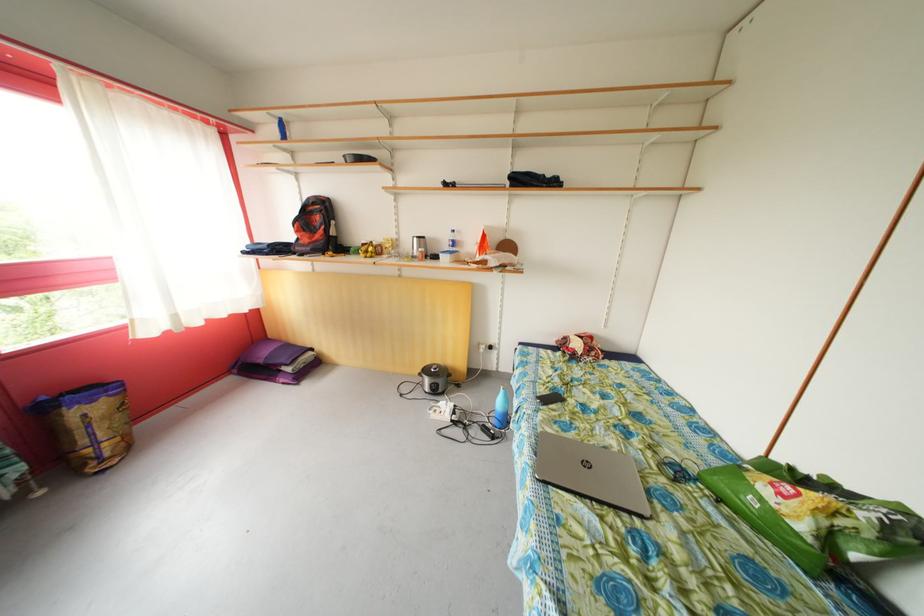
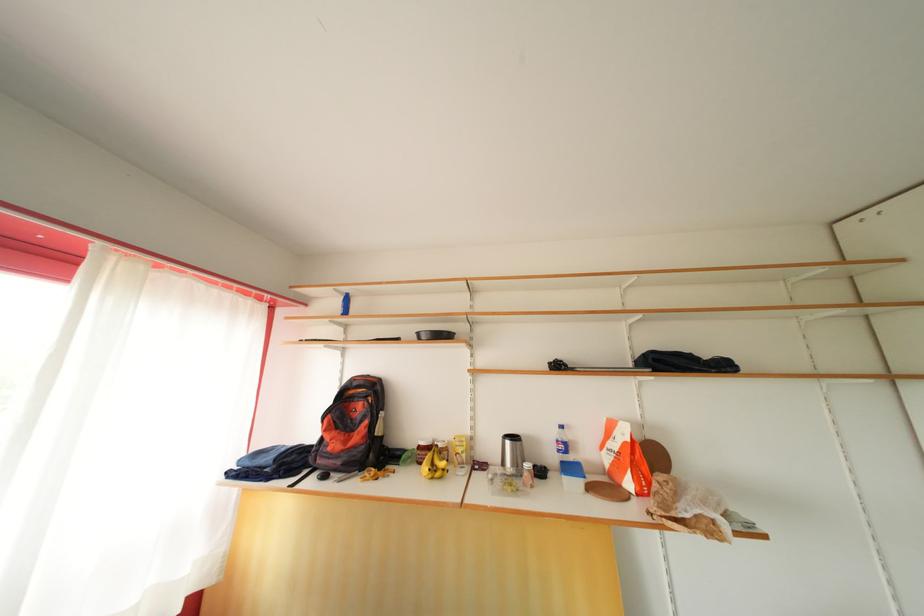
Find the pixel in the second image that matches (x=373, y=252) in the first image.

(436, 461)